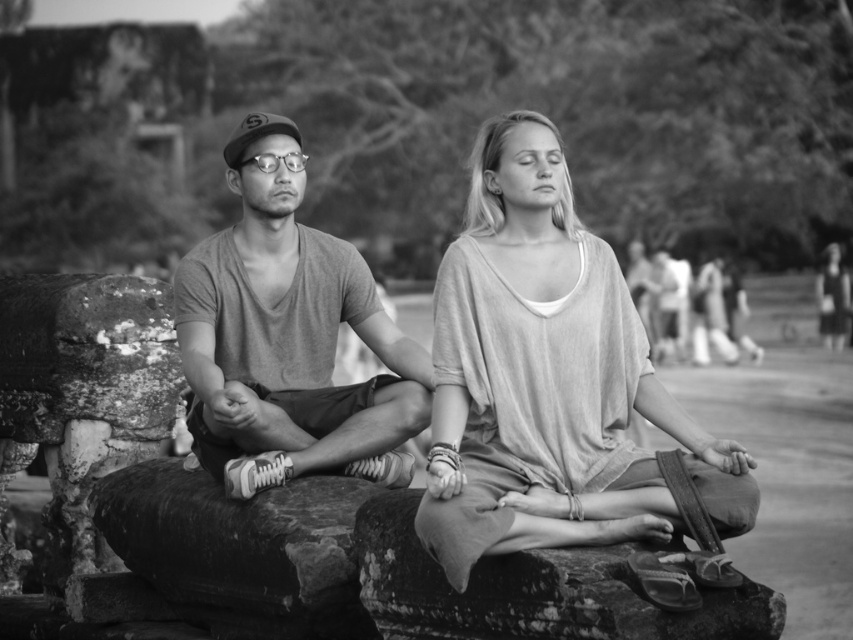
Who is shorter, smooth stone at center or smooth black dress at right?

Standing shorter between the two is smooth stone at center.

Between smooth stone at center and smooth black dress at right, which one appears on the right side from the viewer's perspective?

From the viewer's perspective, smooth black dress at right appears more on the right side.

Where is `smooth stone at center`? smooth stone at center is located at coordinates (534, 589).

Who is taller, matte gray shirt at center or smooth fabric dress at center?

matte gray shirt at center

Is point (636, 339) farther from camera compared to point (656, 256)?

That is False.

You are a GUI agent. You are given a task and a screenshot of the screen. Output one action in this format:
    pyautogui.click(x=<x>, y=<y>)
    Task: Click on the matte gray shirt at center
    
    Given the screenshot: What is the action you would take?
    pyautogui.click(x=546, y=378)

Does point (554, 506) come in front of point (842, 291)?

That is True.

The height and width of the screenshot is (640, 853). Identify the location of matte gray shirt at center. (546, 378).